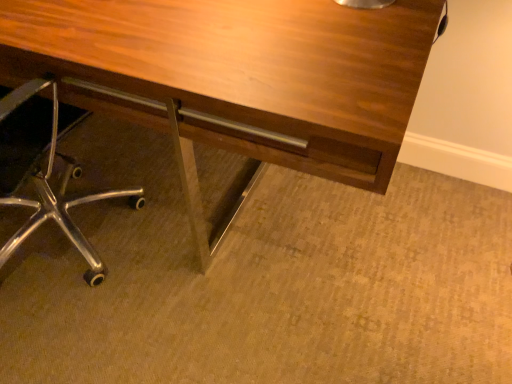
Locate an element on the screen. Image resolution: width=512 pixels, height=384 pixels. blank area beneath wooden desk at center (from a real-world perspective) is located at coordinates (184, 192).